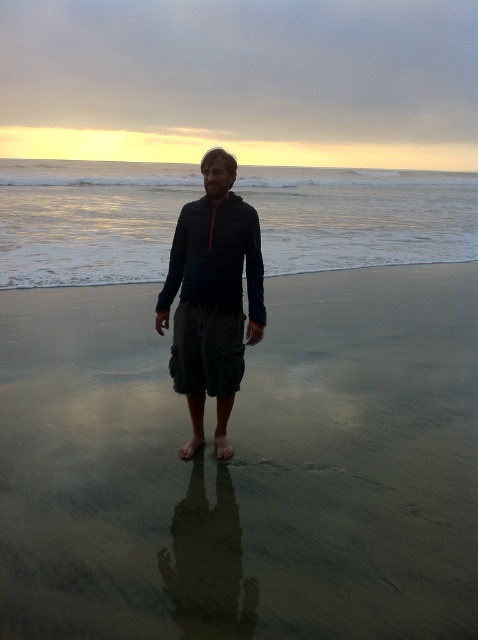
You are standing on the beach and see two points marked on the sand. Which point is closer to you, the point at coordinates point (312, 234) or the point at coordinates point (219, 346)?

Point (312, 234) is further to the viewer than point (219, 346), so the point at coordinates point (219, 346) is closer to you.

You are standing on the beach and want to take a photo of the clear water at center without the sandy at center blocking the view. Is it possible to do so without moving your position?

Answer: The sandy at center is further to the viewer than clear water at center, so the sandy at center would block the view of the clear water at center. Therefore, it is not possible to take a photo of the clear water at center without the sandy at center blocking the view without moving your position.